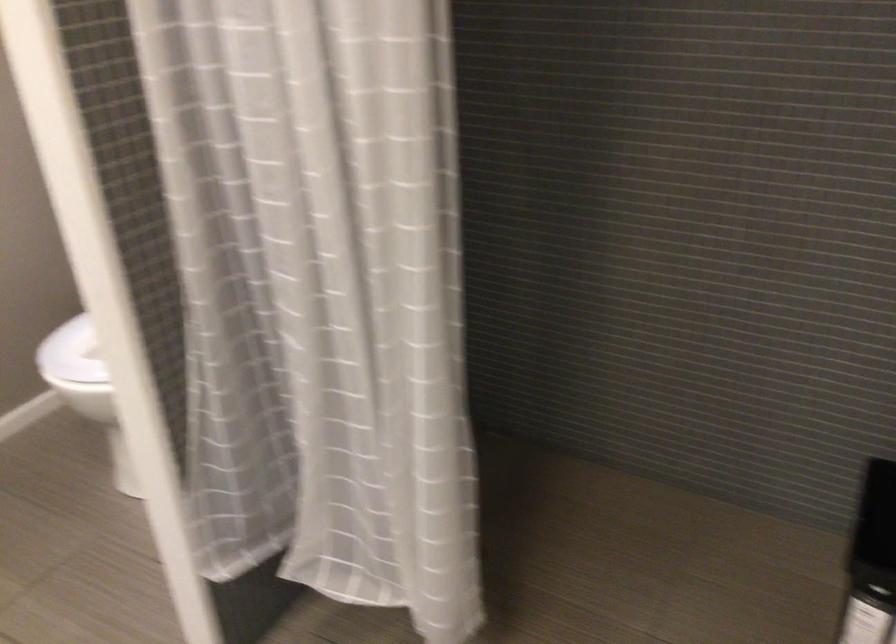
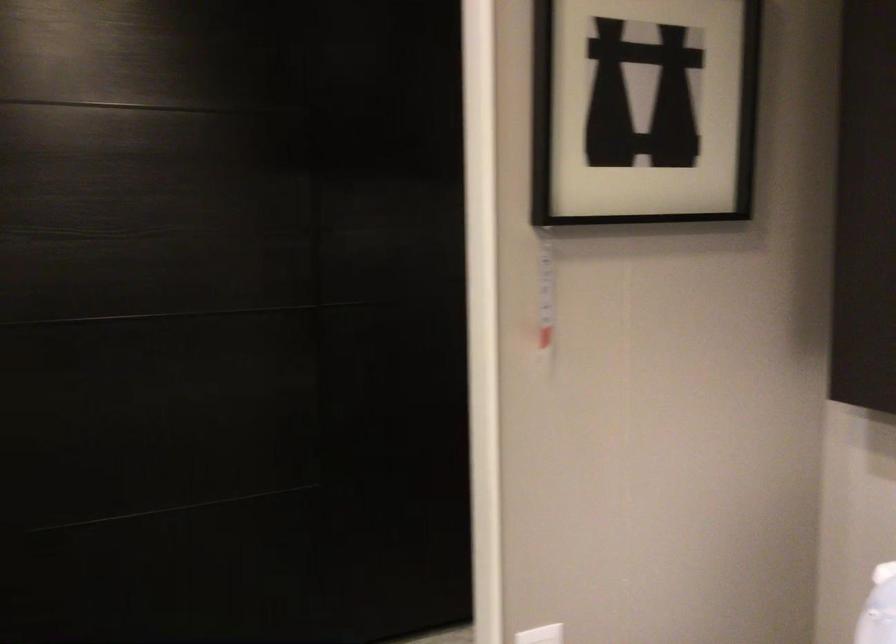
Question: How did the camera likely rotate?

Choices:
 (A) Left
 (B) Right
 (C) Up
 (D) Down

Answer: (A)